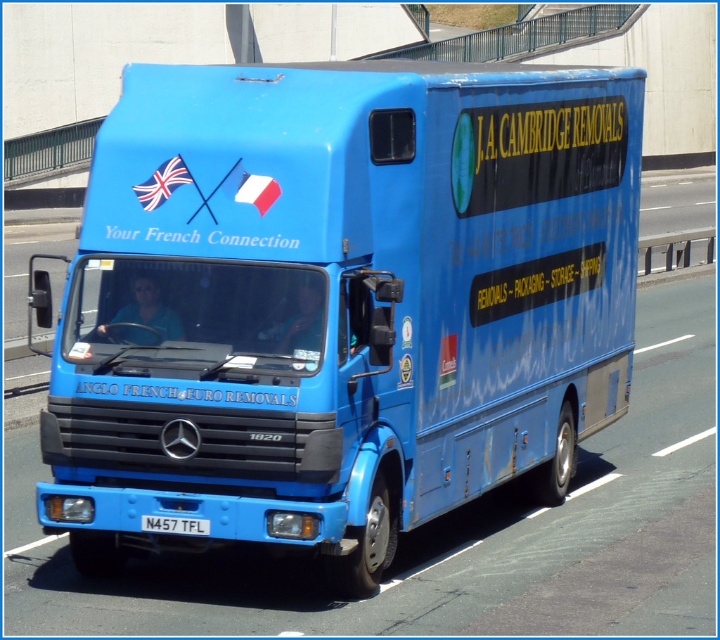
Question: Which point is closer to the camera?

Choices:
 (A) blue metallic license plate at bottom
 (B) blue fabric flag at upper left
 (C) blue fabric flag at center
 (D) blue matte truck at center

Answer: (C)

Question: Which of the following is the farthest from the observer?

Choices:
 (A) blue metallic license plate at bottom
 (B) blue fabric flag at center

Answer: (A)

Question: Does blue matte truck at center come behind blue fabric flag at upper left?

Choices:
 (A) no
 (B) yes

Answer: (B)

Question: Which is farther from the blue fabric flag at center?

Choices:
 (A) blue matte truck at center
 (B) blue metallic license plate at bottom
 (C) blue fabric flag at upper left

Answer: (A)

Question: Is blue fabric flag at upper left below blue fabric flag at center?

Choices:
 (A) no
 (B) yes

Answer: (A)

Question: Is blue fabric flag at upper left to the left of blue fabric flag at center from the viewer's perspective?

Choices:
 (A) yes
 (B) no

Answer: (A)